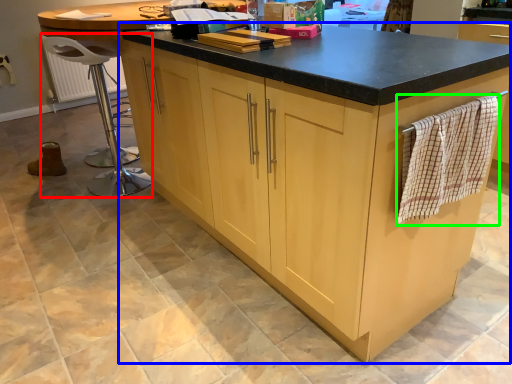
Question: Estimate the real-world distances between objects in this image. Which object is farther from bar stool (highlighted by a red box), cabinetry (highlighted by a blue box) or blanket (highlighted by a green box)?

Choices:
 (A) cabinetry
 (B) blanket

Answer: (B)